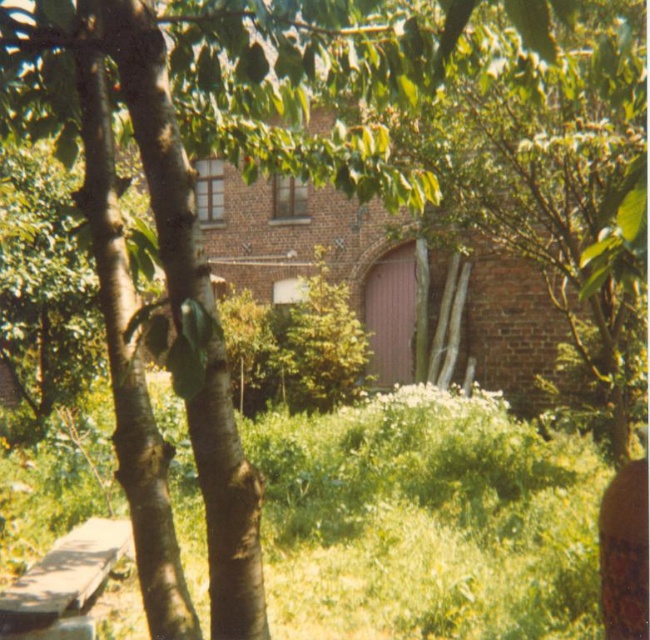
Question: Can you confirm if green grass at center is positioned above brown leather bottle at lower right?

Choices:
 (A) yes
 (B) no

Answer: (B)

Question: Can you confirm if green grass at center is bigger than brown leather bottle at lower right?

Choices:
 (A) no
 (B) yes

Answer: (A)

Question: Among these points, which one is farthest from the camera?

Choices:
 (A) (330, 467)
 (B) (630, 618)

Answer: (A)

Question: Which object appears farthest from the camera in this image?

Choices:
 (A) green grass at center
 (B) brown leather bottle at lower right

Answer: (A)

Question: Is green grass at center closer to camera compared to brown leather bottle at lower right?

Choices:
 (A) yes
 (B) no

Answer: (B)